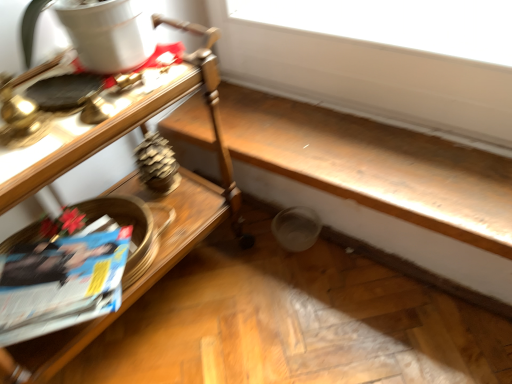
The image size is (512, 384). I want to click on wooden table at left, so click(x=114, y=186).

What do you see at coordinates (114, 186) in the screenshot? I see `wooden table at left` at bounding box center [114, 186].

Describe the element at coordinates (61, 284) in the screenshot. I see `blue glossy magazine at lower left` at that location.

Where is `blue glossy magazine at lower left`? blue glossy magazine at lower left is located at coordinates (61, 284).

Locate an element on the screen. The height and width of the screenshot is (384, 512). wooden table at left is located at coordinates (114, 186).

Can you confirm if wooden table at left is positioned to the left of blue glossy magazine at lower left?

Incorrect, wooden table at left is not on the left side of blue glossy magazine at lower left.

Between wooden table at left and blue glossy magazine at lower left, which one is positioned behind?

blue glossy magazine at lower left is further from the camera.

Is point (55, 369) in front of point (86, 291)?

No, it is not.

From the image's perspective, which is above, wooden table at left or blue glossy magazine at lower left?

wooden table at left, from the image's perspective.

From a real-world perspective, between wooden table at left and blue glossy magazine at lower left, who is vertically higher?

From a 3D spatial view, wooden table at left is above.

Can you confirm if wooden table at left is wider than blue glossy magazine at lower left?

Correct, the width of wooden table at left exceeds that of blue glossy magazine at lower left.

Considering the relative sizes of wooden table at left and blue glossy magazine at lower left in the image provided, is wooden table at left taller than blue glossy magazine at lower left?

Indeed, wooden table at left has a greater height compared to blue glossy magazine at lower left.

Which of these two, wooden table at left or blue glossy magazine at lower left, is bigger?

Bigger between the two is wooden table at left.

Is blue glossy magazine at lower left inside wooden table at left?

Absolutely, blue glossy magazine at lower left is inside wooden table at left.

Is wooden table at left not near blue glossy magazine at lower left?

That's not correct — wooden table at left is a little close to blue glossy magazine at lower left.

Is wooden table at left turned away from blue glossy magazine at lower left?

Correct, wooden table at left is looking away from blue glossy magazine at lower left.

Looking at this image, what's the angular difference between wooden table at left and blue glossy magazine at lower left's facing directions?

There is a 35.5-degree angle between the facing directions of wooden table at left and blue glossy magazine at lower left.

You are a GUI agent. You are given a task and a screenshot of the screen. Output one action in this format:
    pyautogui.click(x=<x>, y=<y>)
    Task: Click on the magazine below the wooden table at left (from the image's perspective)
    
    Given the screenshot: What is the action you would take?
    pyautogui.click(x=61, y=284)

Consider the image. Which object is positioned more to the right, blue glossy magazine at lower left or wooden table at left?

Positioned to the right is wooden table at left.

Which object is further away from the camera taking this photo, blue glossy magazine at lower left or wooden table at left?

blue glossy magazine at lower left.

Is point (8, 325) closer or farther from the camera than point (34, 190)?

Point (8, 325) appears to be closer to the viewer than point (34, 190).

Looking at this image, from the image's perspective, is blue glossy magazine at lower left positioned above or below wooden table at left?

From the image's perspective, blue glossy magazine at lower left appears below wooden table at left.

From a real-world perspective, relative to wooden table at left, is blue glossy magazine at lower left vertically above or below?

blue glossy magazine at lower left is below wooden table at left.

Does blue glossy magazine at lower left have a lesser width compared to wooden table at left?

Indeed, blue glossy magazine at lower left has a lesser width compared to wooden table at left.

Is blue glossy magazine at lower left taller or shorter than wooden table at left?

Considering their sizes, blue glossy magazine at lower left has less height than wooden table at left.

Consider the image. Between blue glossy magazine at lower left and wooden table at left, which one has larger size?

Bigger between the two is wooden table at left.

Is blue glossy magazine at lower left located outside wooden table at left?

Actually, blue glossy magazine at lower left is at least partially inside wooden table at left.

Does blue glossy magazine at lower left touch wooden table at left?

blue glossy magazine at lower left and wooden table at left are not in contact.

Could you tell me if blue glossy magazine at lower left is turned towards wooden table at left?

Yes, blue glossy magazine at lower left is aimed at wooden table at left.

How many degrees apart are the facing directions of blue glossy magazine at lower left and wooden table at left?

35.5 degrees.

Locate an element on the screen. magazine that appears on the left of wooden table at left is located at coordinates (61, 284).

At what (x,y) coordinates should I click in order to perform the action: click on magazine that is under the wooden table at left (from a real-world perspective). Please return your answer as a coordinate pair (x, y). Looking at the image, I should click on (61, 284).

Locate an element on the screen. The image size is (512, 384). magazine on the left of wooden table at left is located at coordinates (61, 284).